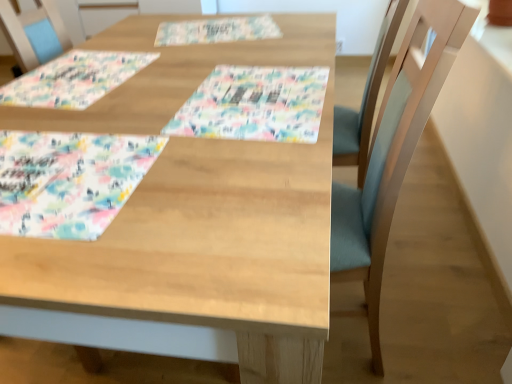
Where is `spots to the right of pastel floral fabric placemat at lower left, which is the 1th place mat in front-to-back order`? The width and height of the screenshot is (512, 384). spots to the right of pastel floral fabric placemat at lower left, which is the 1th place mat in front-to-back order is located at coordinates (225, 171).